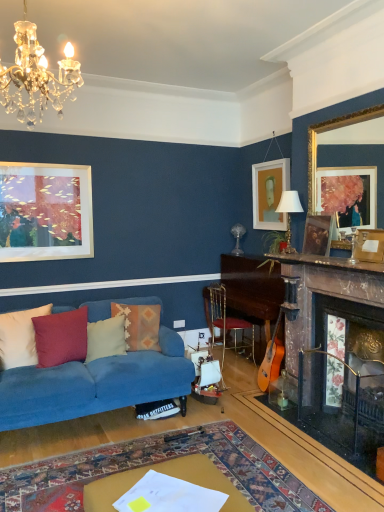
This screenshot has height=512, width=384. I want to click on vacant space behind white paper at lower center, which is the 1th table from bottom to top, so click(181, 470).